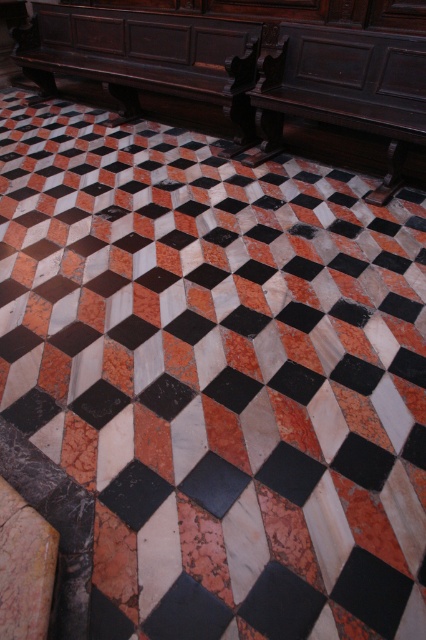
Question: Is polished dark wood bench at center further to camera compared to dark polished wood bench at upper right?

Choices:
 (A) yes
 (B) no

Answer: (A)

Question: Can you confirm if dark wood bench at center is bigger than dark polished wood bench at upper right?

Choices:
 (A) yes
 (B) no

Answer: (A)

Question: Is dark wood bench at center smaller than dark polished wood bench at upper right?

Choices:
 (A) no
 (B) yes

Answer: (A)

Question: Among these objects, which one is farthest from the camera?

Choices:
 (A) dark polished wood bench at upper right
 (B) polished dark wood bench at center

Answer: (B)

Question: Among these objects, which one is nearest to the camera?

Choices:
 (A) dark wood bench at center
 (B) polished dark wood bench at center

Answer: (B)

Question: Which point appears farthest from the camera in this image?

Choices:
 (A) (108, 76)
 (B) (374, 132)

Answer: (A)